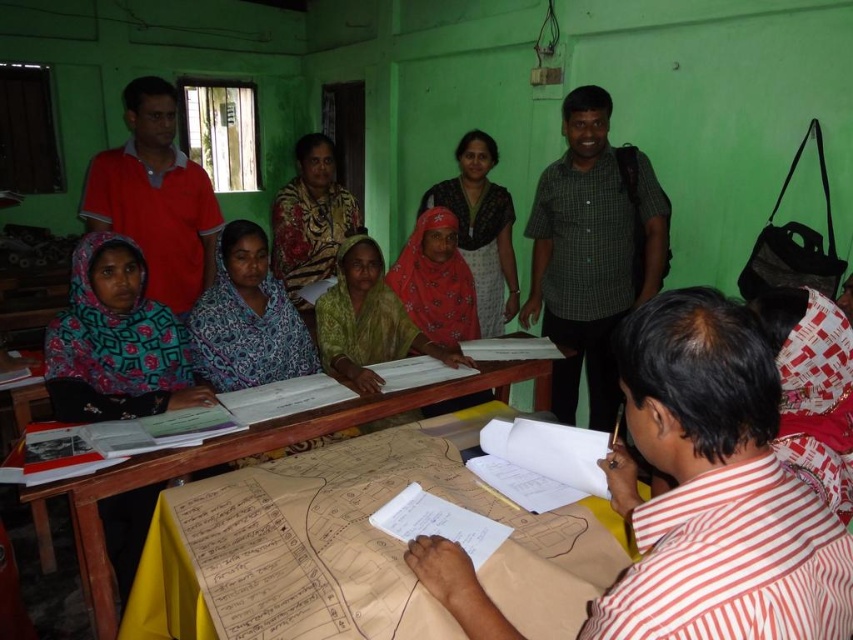
You are a photographer standing at the front of the room. You want to take a photo that includes both the striped cotton shirt at center and the red cotton shirt at upper left. Given that your camera has a maximum focus range of 8 feet, will both subjects be in focus?

The distance between the striped cotton shirt at center and the red cotton shirt at upper left is 8.02 feet. Since the camera can only focus up to 8 feet, the subjects are slightly out of range, so they might not both be in focus.

You are a photographer taking a picture of the striped cotton shirt at center and the red cotton shirt at upper left. Which one will be more visible in the photo?

The striped cotton shirt at center will be more visible in the photo because it is in front of the red cotton shirt at upper left.